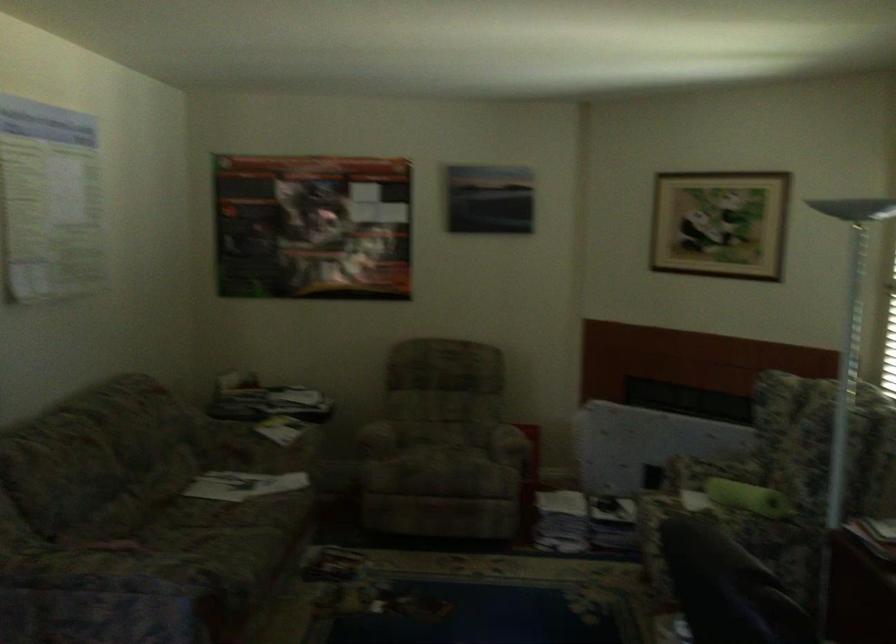
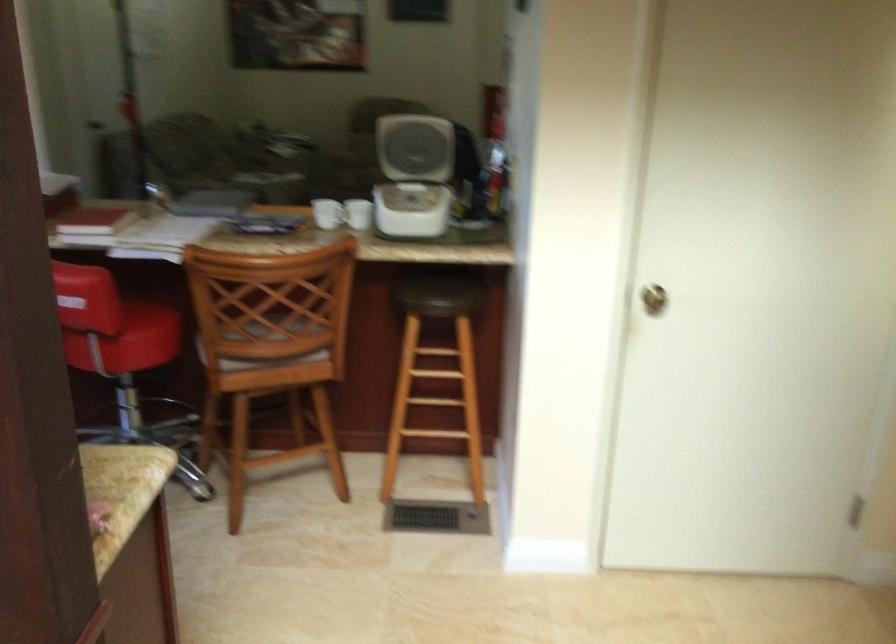
Question: I am providing you with two images of the same scene from different viewpoints. After the viewpoint changes to image2, which objects are now occluded?

Choices:
 (A) yellow lego box
 (B) green cylindrical pillow
 (C) white coffee mug
 (D) red chair sitting surface

Answer: (B)